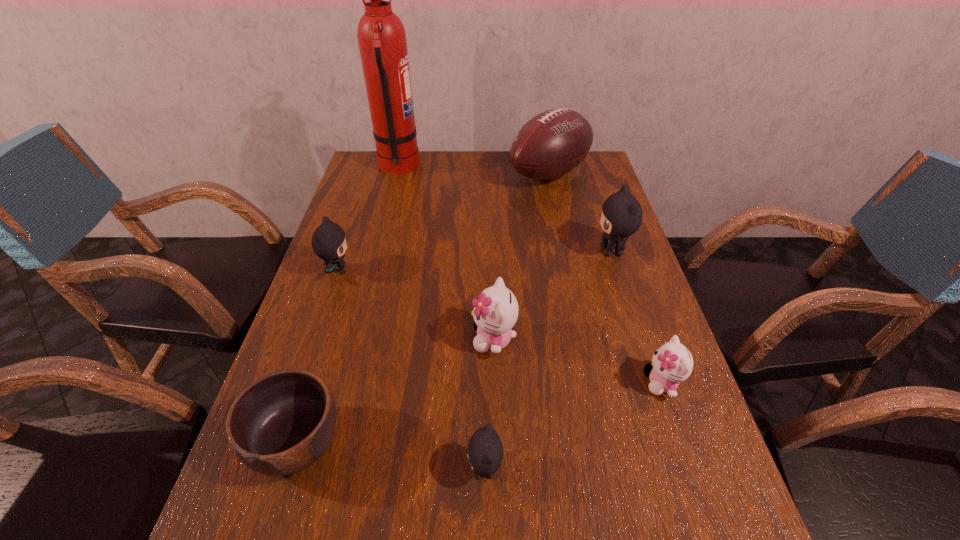
Locate an element on the screen. Image resolution: width=960 pixels, height=540 pixels. the tallest object is located at coordinates (381, 36).

Where is `football (American)`? The width and height of the screenshot is (960, 540). football (American) is located at coordinates (552, 143).

I want to click on the biggest gray kitten, so click(x=621, y=216).

Where is `the bigger white kitten`? The height and width of the screenshot is (540, 960). the bigger white kitten is located at coordinates (495, 312).

Where is `the leftmost gray kitten`? The width and height of the screenshot is (960, 540). the leftmost gray kitten is located at coordinates (329, 242).

Identify the location of the leftmost kitten. (329, 242).

This screenshot has width=960, height=540. Identify the location of bowl. (282, 423).

Where is `the right white kitten`? This screenshot has width=960, height=540. the right white kitten is located at coordinates (672, 363).

This screenshot has width=960, height=540. Find the location of `the second gray kitten from left to right`. the second gray kitten from left to right is located at coordinates (485, 449).

Where is `the nearest kitten`? This screenshot has width=960, height=540. the nearest kitten is located at coordinates (485, 449).